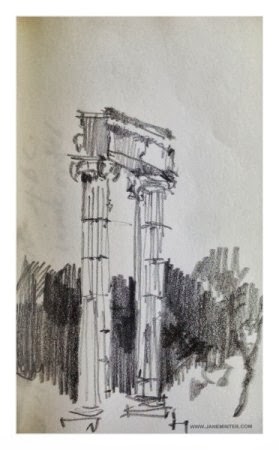
Identify the location of entrance. (118, 373).